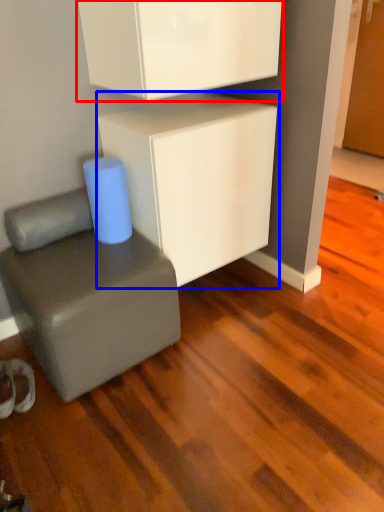
Question: Which point is further to the camera, cabinetry (highlighted by a red box) or cabinetry (highlighted by a blue box)?

Choices:
 (A) cabinetry
 (B) cabinetry

Answer: (B)